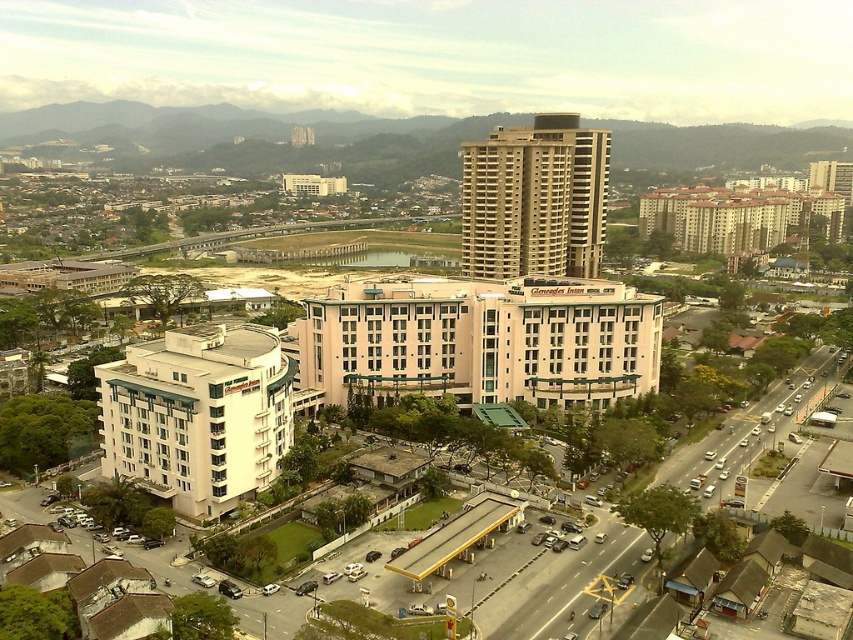
Between pink concrete building at center and white glossy building at lower left, which one is positioned lower?

white glossy building at lower left

Does pink concrete building at center have a greater width compared to white glossy building at lower left?

Correct, the width of pink concrete building at center exceeds that of white glossy building at lower left.

Find the location of a particular element. pink concrete building at center is located at coordinates (482, 340).

Is pink concrete building at center below beige concrete building at center?

Yes.

Can you confirm if pink concrete building at center is wider than beige concrete building at center?

Correct, the width of pink concrete building at center exceeds that of beige concrete building at center.

Locate an element on the screen. The width and height of the screenshot is (853, 640). pink concrete building at center is located at coordinates (482, 340).

Locate an element on the screen. This screenshot has width=853, height=640. pink concrete building at center is located at coordinates (482, 340).

Based on the photo, does white glossy building at lower left appear on the right side of beige concrete building at center?

Incorrect, white glossy building at lower left is not on the right side of beige concrete building at center.

Does white glossy building at lower left lie in front of beige concrete building at center?

Yes, white glossy building at lower left is closer to the viewer.

Who is more forward, (258, 403) or (554, 189)?

Point (258, 403) is in front.

Locate an element on the screen. white glossy building at lower left is located at coordinates (198, 413).